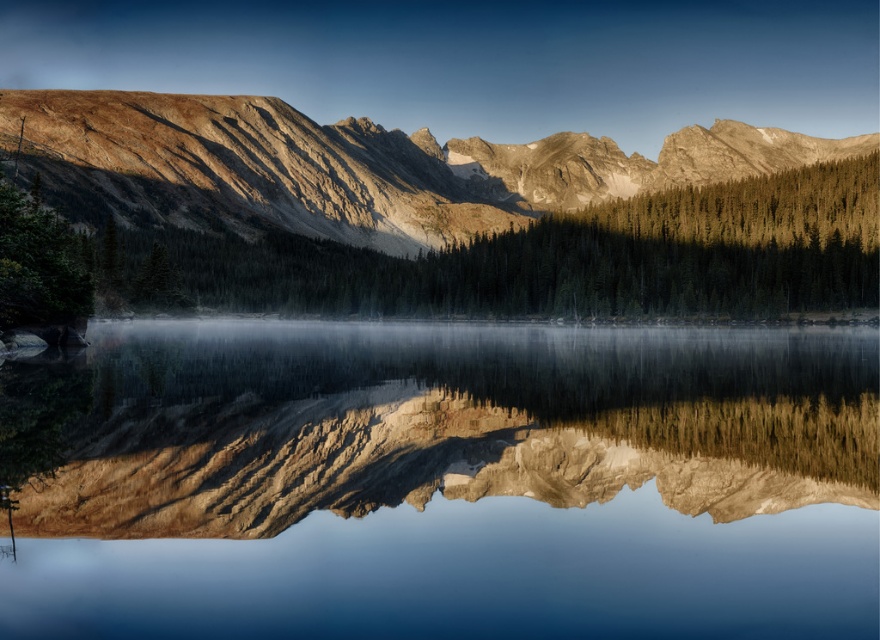
In the scene shown: Is smooth reflective water at center thinner than green matte trees at upper center?

Indeed, smooth reflective water at center has a lesser width compared to green matte trees at upper center.

Can you confirm if smooth reflective water at center is wider than green matte trees at upper center?

No, smooth reflective water at center is not wider than green matte trees at upper center.

What do you see at coordinates (442, 481) in the screenshot? Image resolution: width=880 pixels, height=640 pixels. I see `smooth reflective water at center` at bounding box center [442, 481].

The image size is (880, 640). In order to click on smooth reflective water at center in this screenshot , I will do `click(442, 481)`.

Describe the element at coordinates (350, 166) in the screenshot. The height and width of the screenshot is (640, 880). I see `rugged stone mountain range at upper center` at that location.

Which of these two, rugged stone mountain range at upper center or green matte trees at upper center, stands taller?

rugged stone mountain range at upper center

Is point (362, 204) positioned after point (761, 216)?

Yes, point (362, 204) is farther from viewer.

Find the location of a particular element. This screenshot has width=880, height=640. rugged stone mountain range at upper center is located at coordinates (350, 166).

Is smooth reflective water at center further to camera compared to rugged stone mountain range at upper center?

No, smooth reflective water at center is closer to the viewer.

Can you confirm if smooth reflective water at center is thinner than rugged stone mountain range at upper center?

Correct, smooth reflective water at center's width is less than rugged stone mountain range at upper center's.

What are the coordinates of `smooth reflective water at center` in the screenshot? It's located at (442, 481).